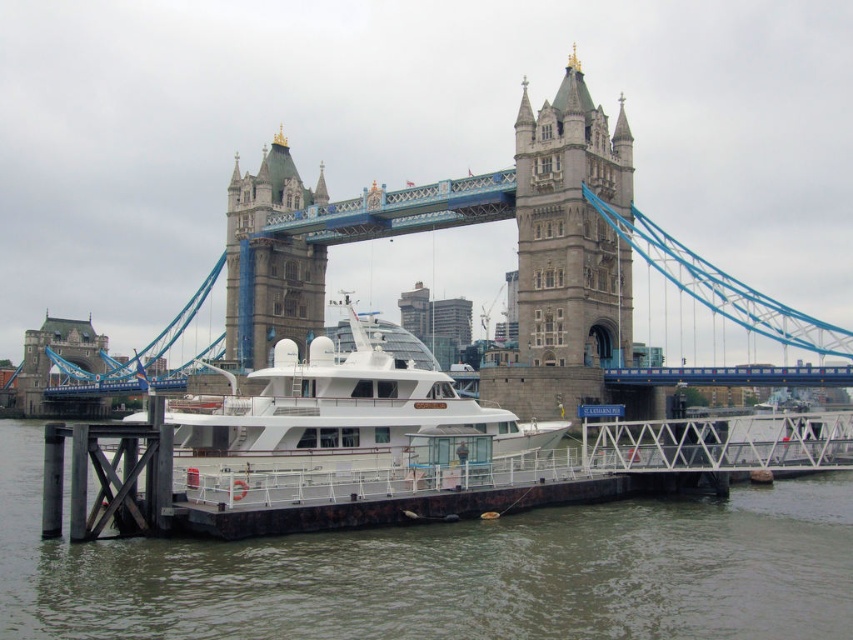
Question: Does white glossy boat at center appear on the left side of stone stonework tower at upper center?

Choices:
 (A) no
 (B) yes

Answer: (A)

Question: Does brown water at lower center appear over stone stonework tower at upper center?

Choices:
 (A) no
 (B) yes

Answer: (A)

Question: Which object is the closest to the brown water at lower center?

Choices:
 (A) stone tower at center
 (B) white glossy boat at center
 (C) stone stonework tower at upper center

Answer: (B)

Question: Is white glossy boat at center in front of stone stonework tower at upper center?

Choices:
 (A) yes
 (B) no

Answer: (A)

Question: Based on their relative distances, which object is farther from the brown water at lower center?

Choices:
 (A) white glossy boat at center
 (B) stone tower at center

Answer: (B)

Question: Based on their relative distances, which object is nearer to the brown water at lower center?

Choices:
 (A) stone tower at center
 (B) white glossy boat at center

Answer: (B)